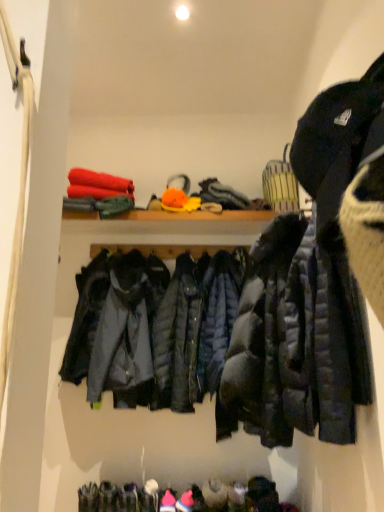
Question: Does matte black jacket at center, the 1th jacket from the left, contain matte black puffer jacket at right, which ranks as the first jacket in right-to-left order?

Choices:
 (A) yes
 (B) no

Answer: (B)

Question: Considering the relative sizes of matte black jacket at center, placed as the 2th jacket when sorted from front to back, and matte black puffer jacket at right, which is counted as the second jacket, starting from the back, in the image provided, is matte black jacket at center, placed as the 2th jacket when sorted from front to back, taller than matte black puffer jacket at right, which is counted as the second jacket, starting from the back,?

Choices:
 (A) no
 (B) yes

Answer: (A)

Question: Would you say matte black jacket at center, placed as the 2th jacket when sorted from front to back, is a long distance from matte black puffer jacket at right, which is the second jacket in left-to-right order?

Choices:
 (A) no
 (B) yes

Answer: (A)

Question: Is matte black jacket at center, the 1th jacket from the left, positioned in front of matte black puffer jacket at right, which is the second jacket in left-to-right order?

Choices:
 (A) yes
 (B) no

Answer: (B)

Question: Does matte black jacket at center, which is the 2th jacket from right to left, appear on the right side of matte black puffer jacket at right, marked as the 1th jacket in a front-to-back arrangement?

Choices:
 (A) yes
 (B) no

Answer: (B)

Question: From a real-world perspective, is matte black jacket at center, the 1th jacket from the left, beneath matte black puffer jacket at right, which is the second jacket in left-to-right order?

Choices:
 (A) yes
 (B) no

Answer: (A)

Question: From a real-world perspective, is matte black puffer jacket at right, which ranks as the first jacket in right-to-left order, positioned under matte black jacket at center, the 1th jacket from the left, based on gravity?

Choices:
 (A) yes
 (B) no

Answer: (B)

Question: Could you tell me if matte black puffer jacket at right, which is the second jacket in left-to-right order, is facing matte black jacket at center, which is the 2th jacket from right to left?

Choices:
 (A) no
 (B) yes

Answer: (A)

Question: Is matte black puffer jacket at right, which is counted as the second jacket, starting from the back, closer to camera compared to matte black jacket at center, placed as the 2th jacket when sorted from front to back?

Choices:
 (A) yes
 (B) no

Answer: (A)

Question: Is matte black puffer jacket at right, which is the second jacket in left-to-right order, positioned with its back to matte black jacket at center, which is the 2th jacket from right to left?

Choices:
 (A) no
 (B) yes

Answer: (A)

Question: From the image's perspective, is matte black puffer jacket at right, marked as the 1th jacket in a front-to-back arrangement, under matte black jacket at center, the 1th jacket from the left?

Choices:
 (A) yes
 (B) no

Answer: (B)

Question: Is matte black puffer jacket at right, marked as the 1th jacket in a front-to-back arrangement, further to the viewer compared to matte black jacket at center, which is the 2th jacket from right to left?

Choices:
 (A) no
 (B) yes

Answer: (A)

Question: Is point (104, 381) closer or farther from the camera than point (278, 362)?

Choices:
 (A) closer
 (B) farther

Answer: (B)